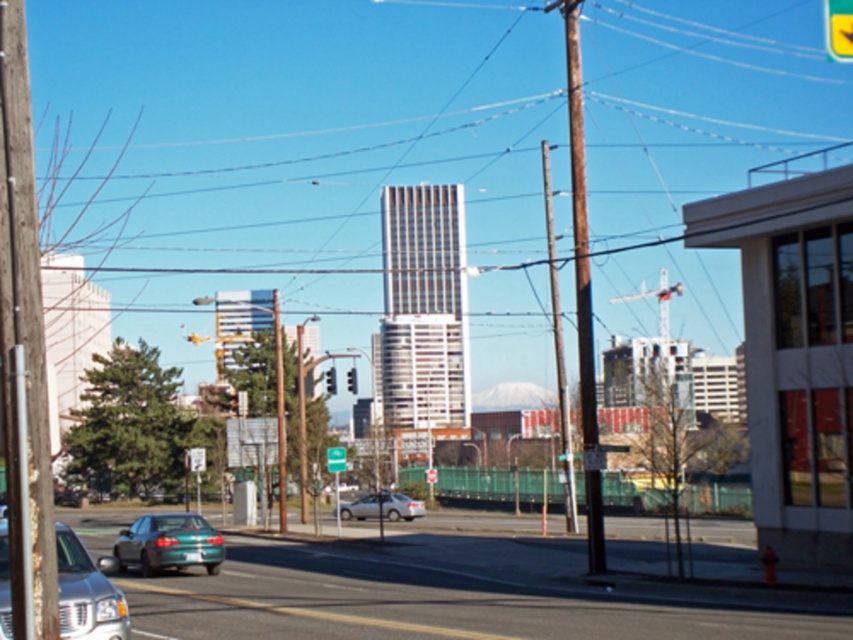
Who is shorter, teal glossy sedan at lower left or metallic traffic light at center?

metallic traffic light at center

Does teal glossy sedan at lower left have a greater height compared to metallic traffic light at center?

Indeed, teal glossy sedan at lower left has a greater height compared to metallic traffic light at center.

Between point (183, 534) and point (328, 387), which one is positioned behind?

Point (328, 387)

Find the location of a particular element. teal glossy sedan at lower left is located at coordinates (167, 544).

Is green plastic sign at upper center to the right of red glass traffic light at center from the viewer's perspective?

Yes, green plastic sign at upper center is to the right of red glass traffic light at center.

Who is positioned more to the left, green plastic sign at upper center or red glass traffic light at center?

From the viewer's perspective, red glass traffic light at center appears more on the left side.

Where is `green plastic sign at upper center`? The width and height of the screenshot is (853, 640). green plastic sign at upper center is located at coordinates (335, 458).

Can you confirm if brown wooden telegraph pole at center is taller than silver metallic sedan at center?

Yes, brown wooden telegraph pole at center is taller than silver metallic sedan at center.

Measure the distance between point (567, 125) and camera.

Point (567, 125) and camera are 183.84 meters apart.

This screenshot has width=853, height=640. What are the coordinates of `brown wooden telegraph pole at center` in the screenshot? It's located at 582,292.